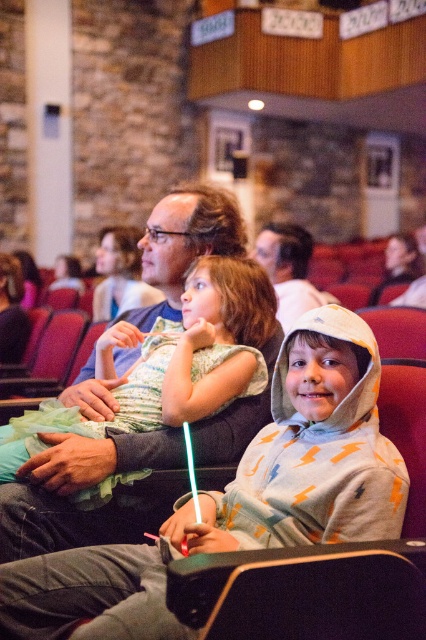
Question: Which object is the farthest from the light gray hoodie at center?

Choices:
 (A) matte gray hoodie at center
 (B) smooth white hoodie at center
 (C) matte brown hair at center

Answer: (B)

Question: In this image, where is matte green dress at center located relative to matte brown hair at center?

Choices:
 (A) left
 (B) right

Answer: (B)

Question: Can you confirm if matte gray hoodie at center is smaller than smooth white hoodie at center?

Choices:
 (A) no
 (B) yes

Answer: (A)

Question: Which of the following is the closest to the observer?

Choices:
 (A) (112, 266)
 (B) (152, 352)

Answer: (B)

Question: From the image, what is the correct spatial relationship of matte green dress at center in relation to matte pink dress at center?

Choices:
 (A) above
 (B) below

Answer: (B)

Question: Based on their relative distances, which object is nearer to the matte brown hair at center?

Choices:
 (A) matte pink dress at center
 (B) matte green dress at center
 (C) smooth white hoodie at center

Answer: (B)